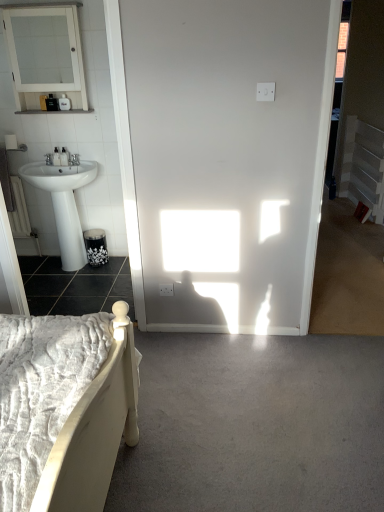
You are a GUI agent. You are given a task and a screenshot of the screen. Output one action in this format:
    pyautogui.click(x=<x>, y=<y>)
    Task: Click on the blank space above gray carpet at lower center, marked as the 1th concrete in a front-to-back arrangement (from a real-world perspective)
    
    Given the screenshot: What is the action you would take?
    pyautogui.click(x=218, y=399)